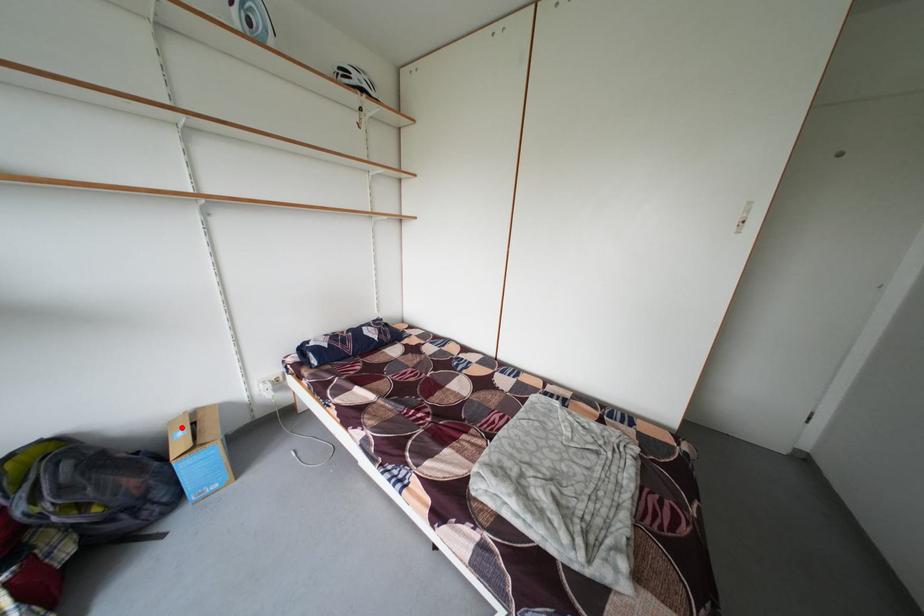
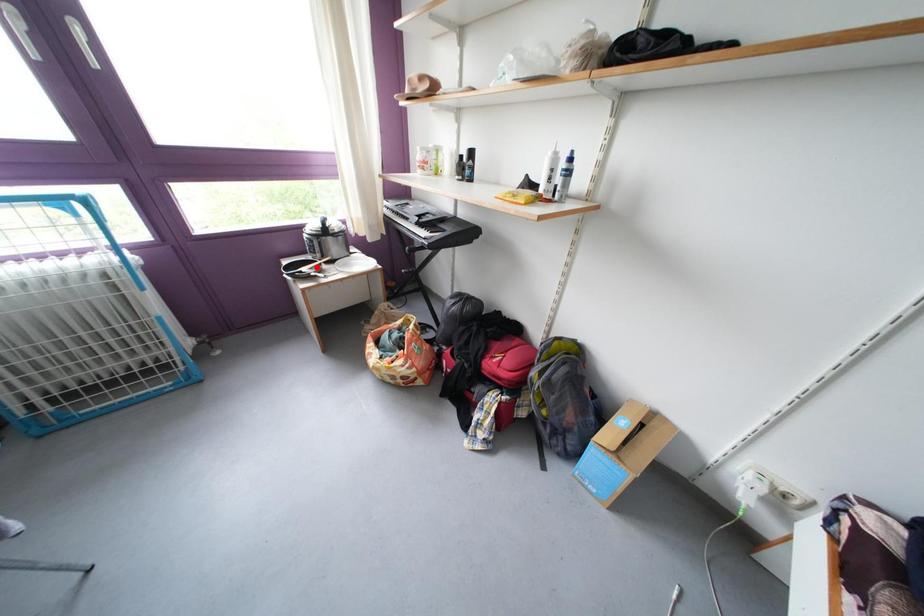
I am providing you with two images of the same scene from different viewpoints. A red point is marked on the first image and another point is marked on the second image. Is the marked point in image1 the same physical position as the marked point in image2?

No